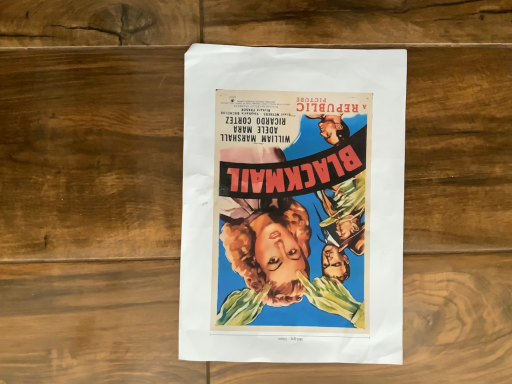
The image size is (512, 384). What do you see at coordinates (292, 205) in the screenshot?
I see `vibrant paper poster at center` at bounding box center [292, 205].

The height and width of the screenshot is (384, 512). What are the coordinates of `vibrant paper poster at center` in the screenshot? It's located at (292, 205).

What is the approximate width of vibrant paper poster at center?

30.73 centimeters.

Identify the location of vibrant paper poster at center. Image resolution: width=512 pixels, height=384 pixels. pos(292,205).